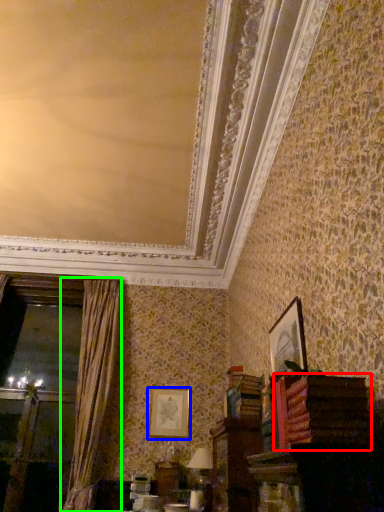
Question: Which object is positioned closest to book (highlighted by a red box)? Select from picture frame (highlighted by a blue box) and curtain (highlighted by a green box).

Choices:
 (A) picture frame
 (B) curtain

Answer: (A)